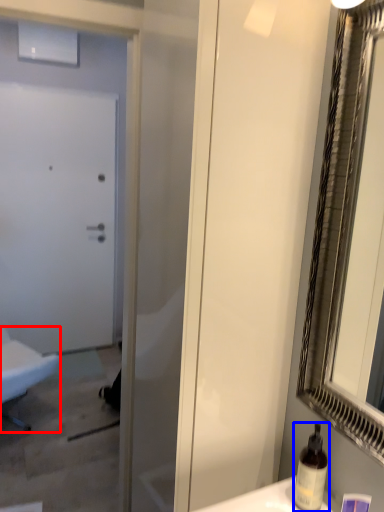
Question: Which object appears farthest to the camera in this image, furniture (highlighted by a red box) or bottle (highlighted by a blue box)?

Choices:
 (A) furniture
 (B) bottle

Answer: (A)